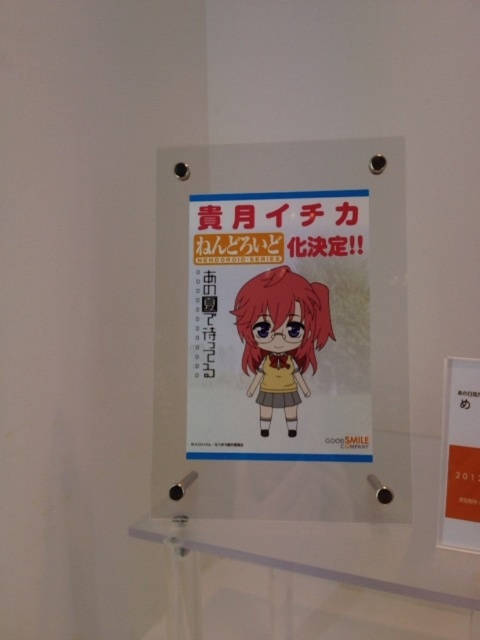
Question: Which point is farther from the camera taking this photo?

Choices:
 (A) (208, 308)
 (B) (312, 333)

Answer: (A)

Question: Among these objects, which one is farthest from the camera?

Choices:
 (A) matte yellow uniform at center
 (B) matte paper poster at center

Answer: (A)

Question: Is matte paper poster at center bigger than matte yellow uniform at center?

Choices:
 (A) yes
 (B) no

Answer: (A)

Question: Is matte paper poster at center positioned in front of matte yellow uniform at center?

Choices:
 (A) yes
 (B) no

Answer: (A)

Question: Can you confirm if matte paper poster at center is positioned to the left of matte yellow uniform at center?

Choices:
 (A) no
 (B) yes

Answer: (B)